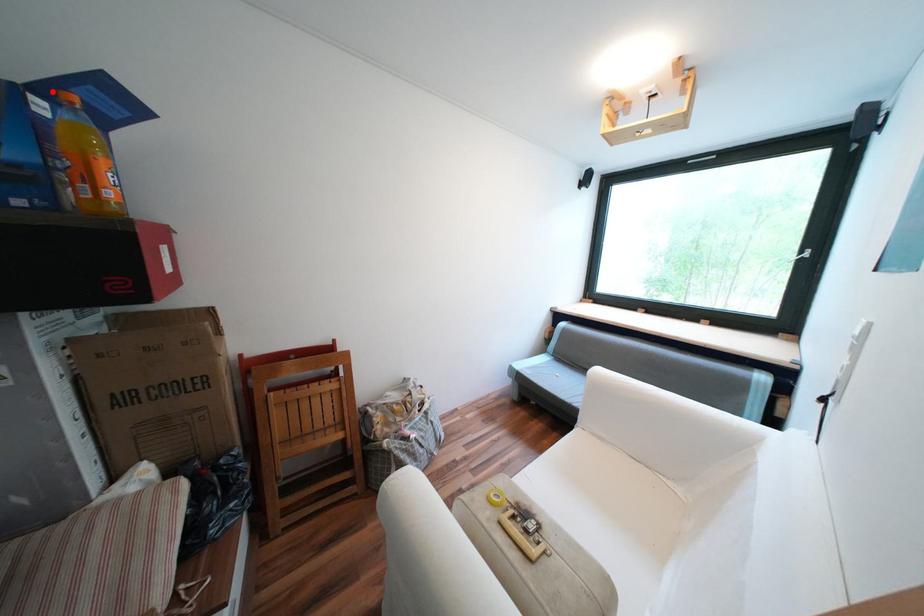
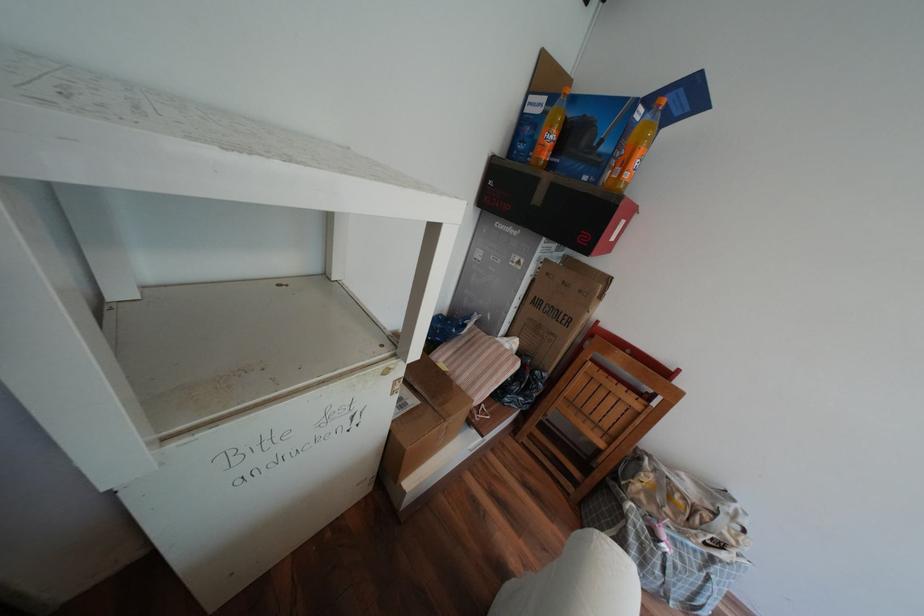
Find the pixel in the second image that matches the highlighted location in the first image.

(659, 100)